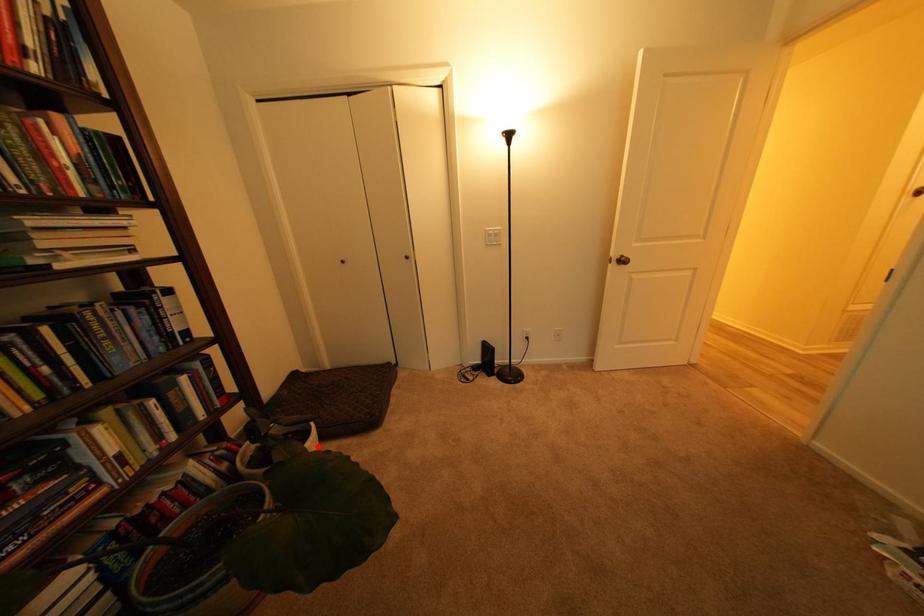
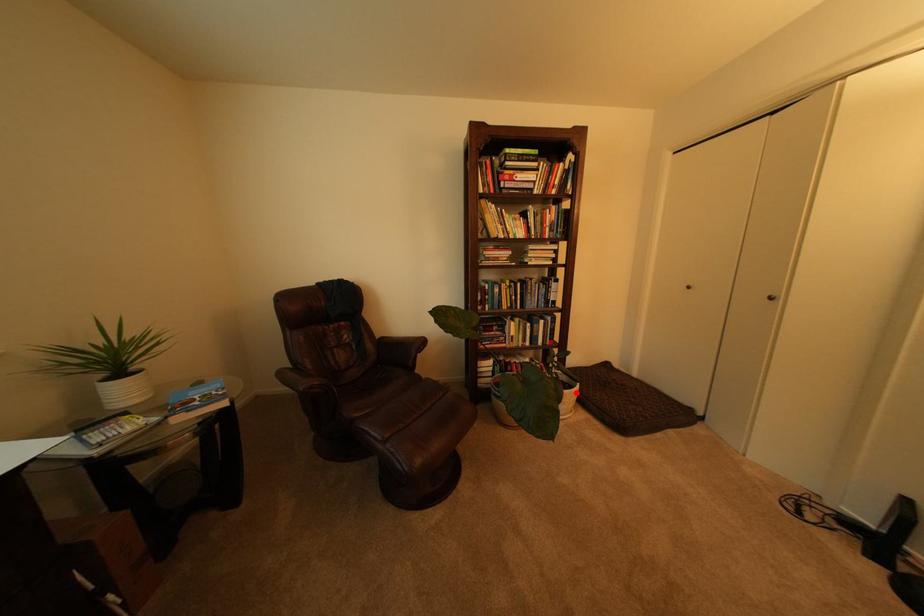
I am providing you with two images of the same scene from different viewpoints. A red point is marked on the first image and another point is marked on the second image. Is the marked point in image1 the same physical position as the marked point in image2?

Yes